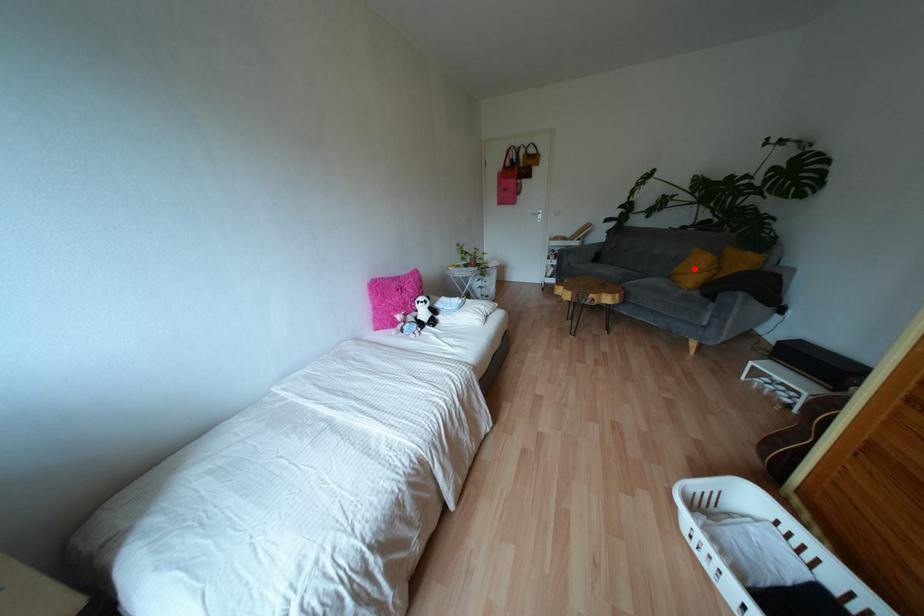
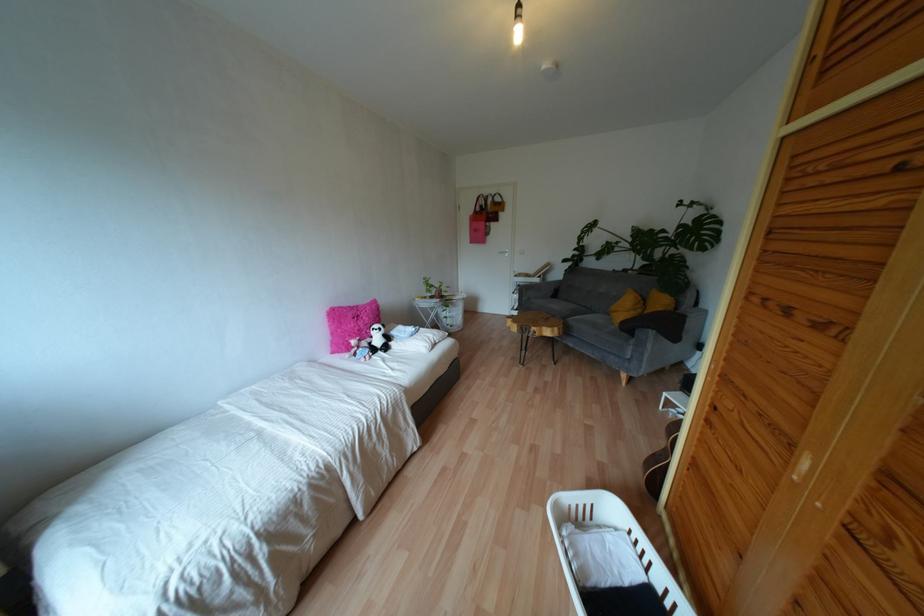
Locate, in the second image, the point that corresponds to the highlighted location in the first image.

(623, 308)